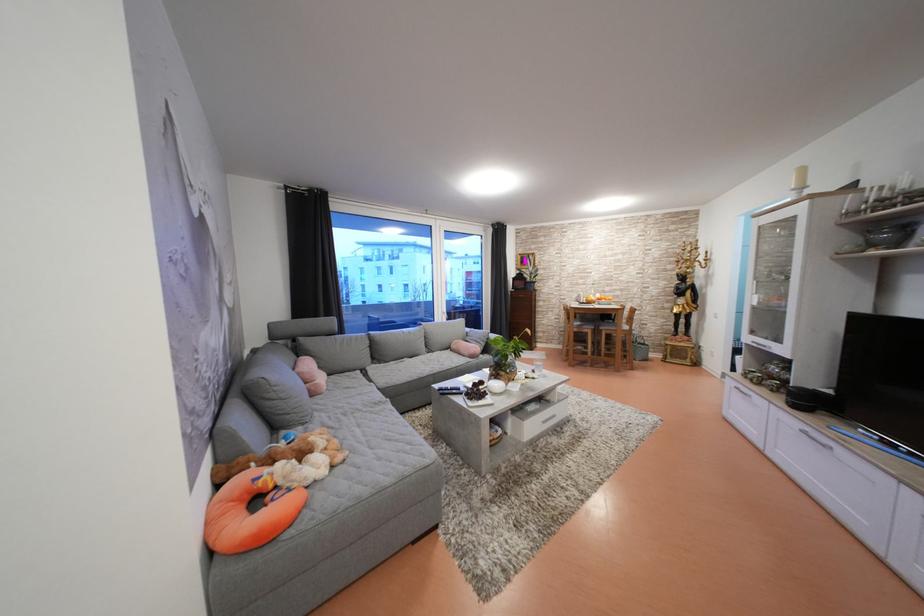
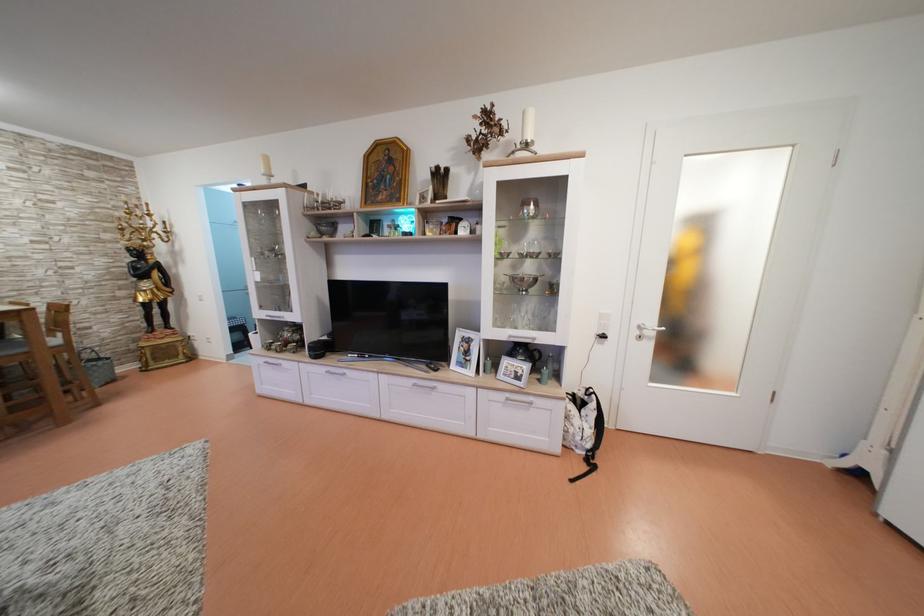
The point at (621, 325) is marked in the first image. Where is the corresponding point in the second image?

(7, 339)